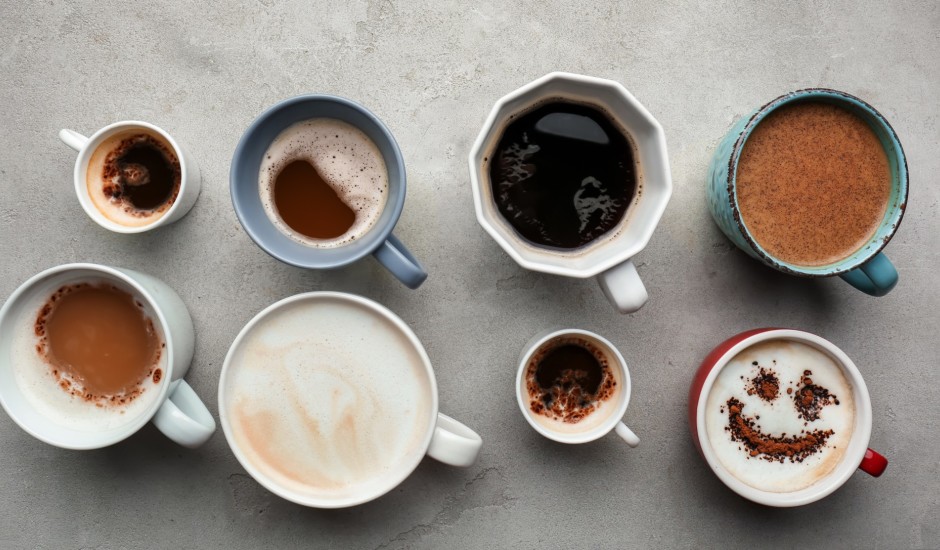
Locate an element on the screen. The width and height of the screenshot is (940, 550). cup handles is located at coordinates (73, 136), (394, 258), (622, 288), (884, 276), (876, 466), (625, 432), (449, 445), (188, 424).